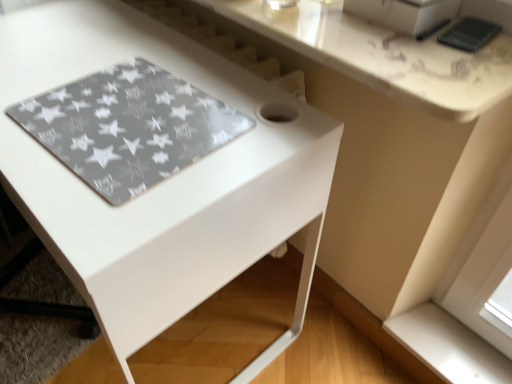
The image size is (512, 384). I want to click on unoccupied space behind transparent star-patterned mat at lower left, so click(x=137, y=54).